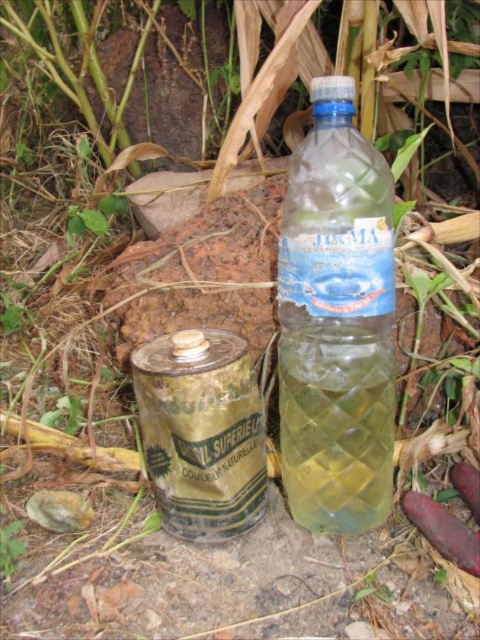
Which is above, clear plastic bottle at center or green metallic can at center?

clear plastic bottle at center

Is point (342, 145) in front of point (242, 364)?

That is True.

You are a GUI agent. You are given a task and a screenshot of the screen. Output one action in this format:
    pyautogui.click(x=<x>, y=<y>)
    Task: Click on the clear plastic bottle at center
    
    Given the screenshot: What is the action you would take?
    pyautogui.click(x=336, y=323)